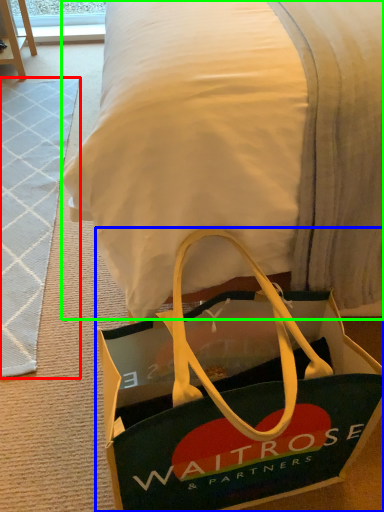
Question: Which object is positioned farthest from doormat (highlighted by a red box)? Select from handbag (highlighted by a blue box) and blanket (highlighted by a green box).

Choices:
 (A) handbag
 (B) blanket

Answer: (B)